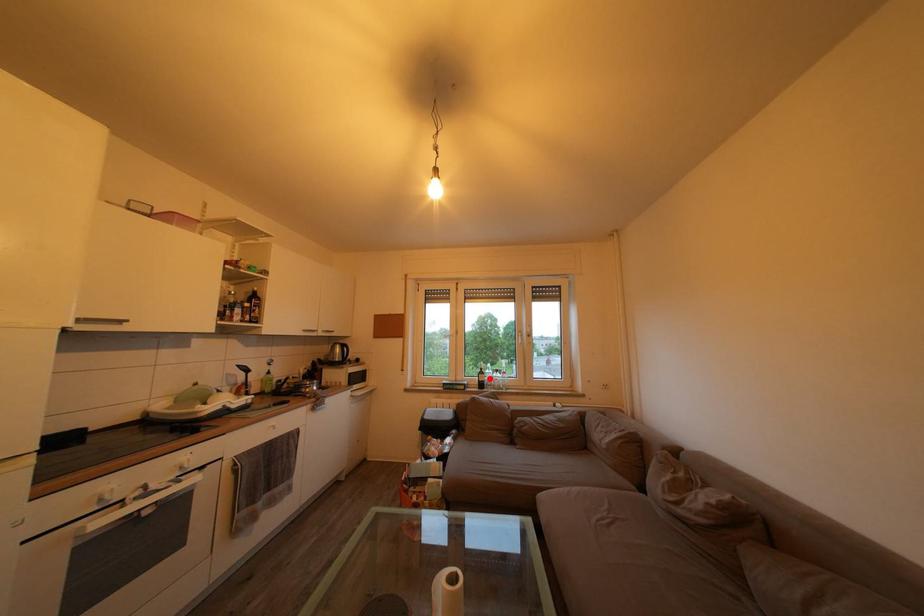
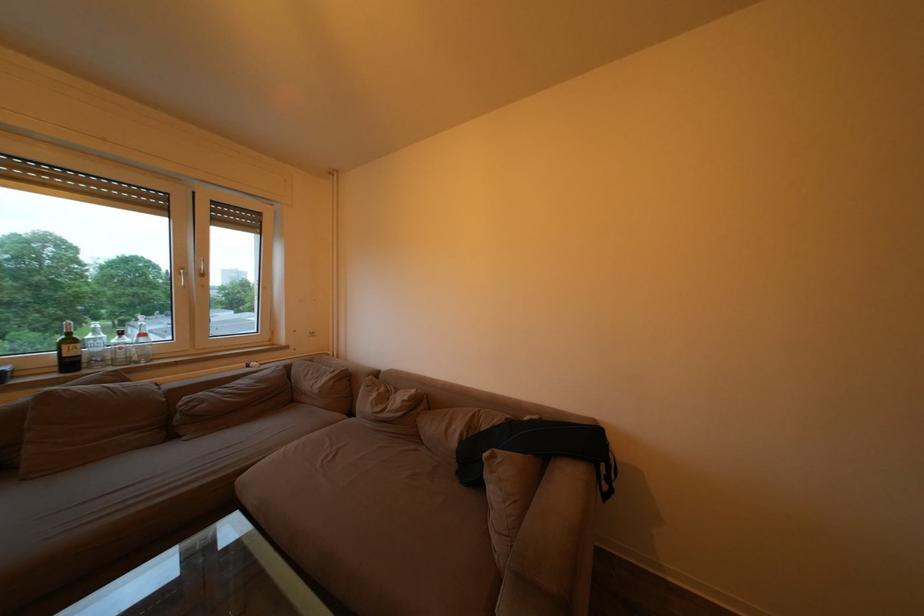
Question: I am providing you with two images of the same scene from different viewpoints. A red point is marked on the first image. At the location where the point appears in image 1, is it still visible in image 2?

Choices:
 (A) Yes
 (B) No

Answer: (A)